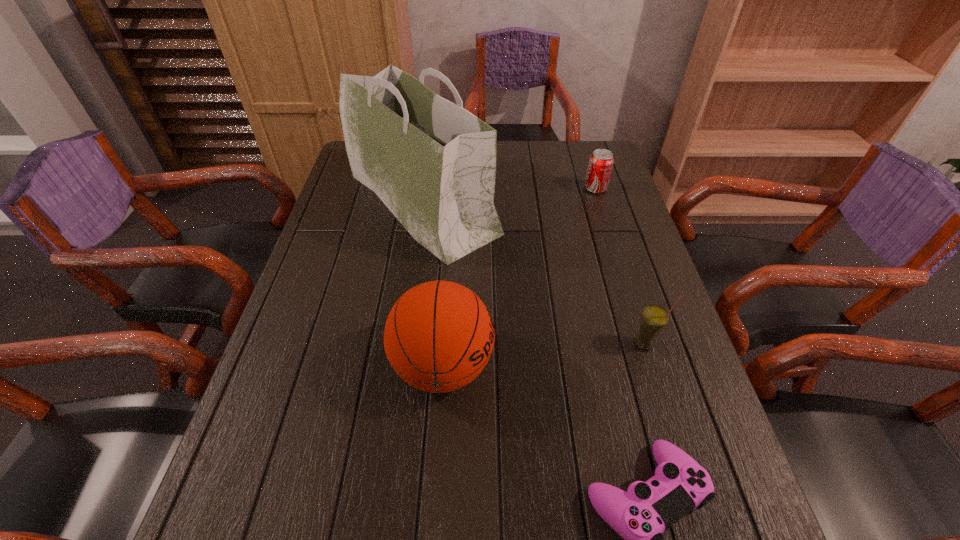
This screenshot has height=540, width=960. Identify the location of free point between the third tallest object and the tallest object. pyautogui.click(x=534, y=273).

Find the location of a particular element. object that is the fourth closest to the nearest object is located at coordinates (600, 165).

Select which object is the closest to the third shortest object. Please provide its 2D coordinates. Your answer should be formatted as a tuple, i.e. [(x, y)], where the tuple contains the x and y coordinates of a point satisfying the conditions above.

[(640, 516)]

Where is `vacant space that satisfies the following two spatial constraints: 1. on the back side of the tallest object; 2. on the right side of the second shortest object`? vacant space that satisfies the following two spatial constraints: 1. on the back side of the tallest object; 2. on the right side of the second shortest object is located at coordinates (425, 188).